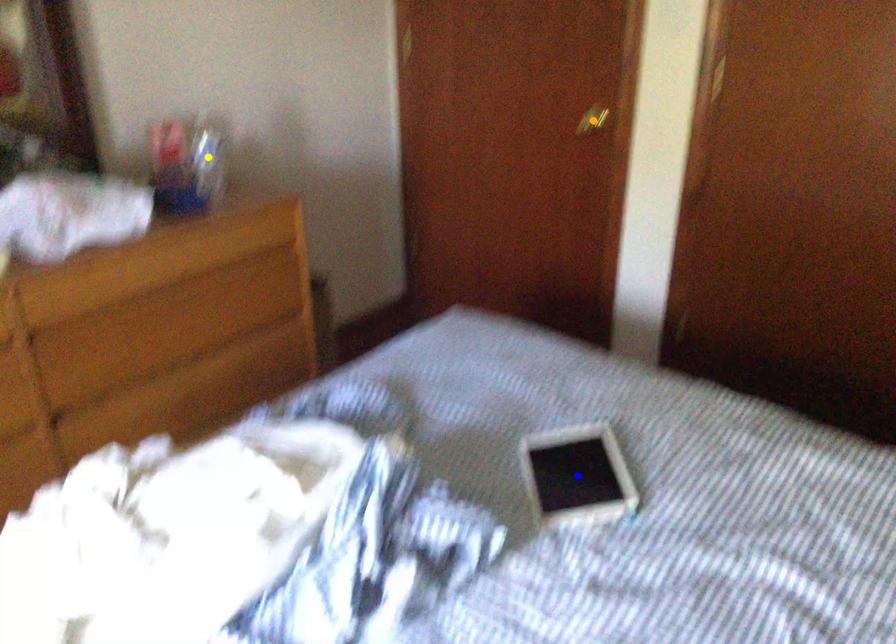
Order these from nearest to farthest:
yellow point, blue point, orange point

blue point → yellow point → orange point